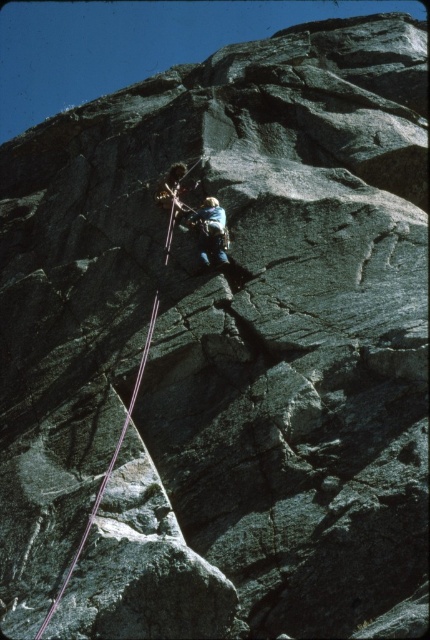
Which is more to the left, purple synthetic rope at center or camouflage fabric climbing harness at center?

purple synthetic rope at center

Which is in front, point (55, 600) or point (223, 246)?

Point (55, 600) is in front.

Locate an element on the screen. The width and height of the screenshot is (430, 640). purple synthetic rope at center is located at coordinates (106, 468).